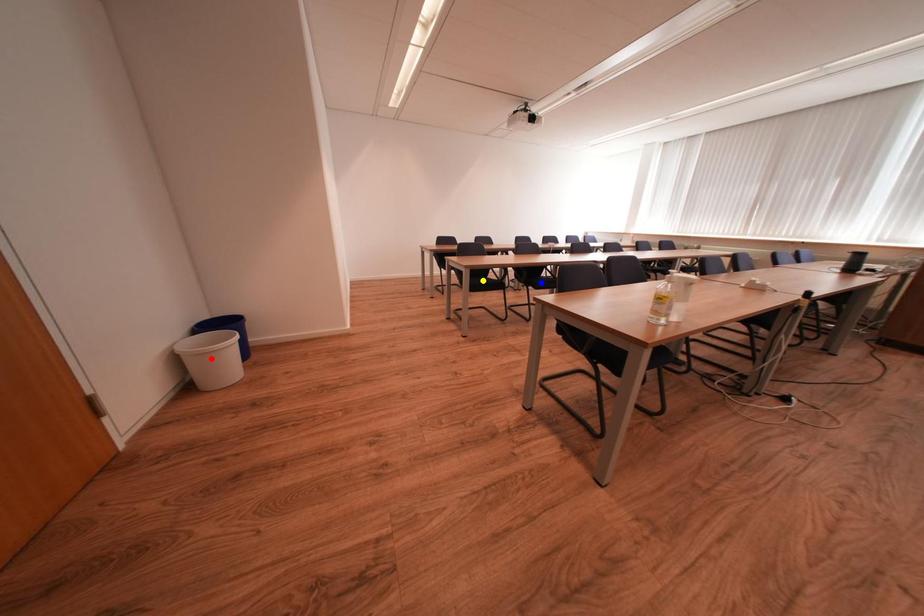
Order these from nearest to farthest:
red point
yellow point
blue point

blue point
yellow point
red point